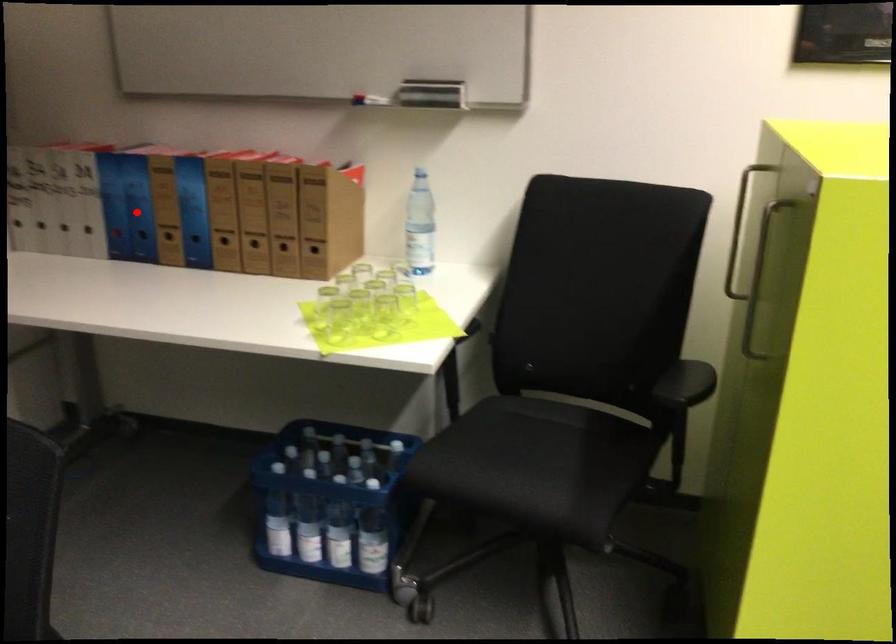
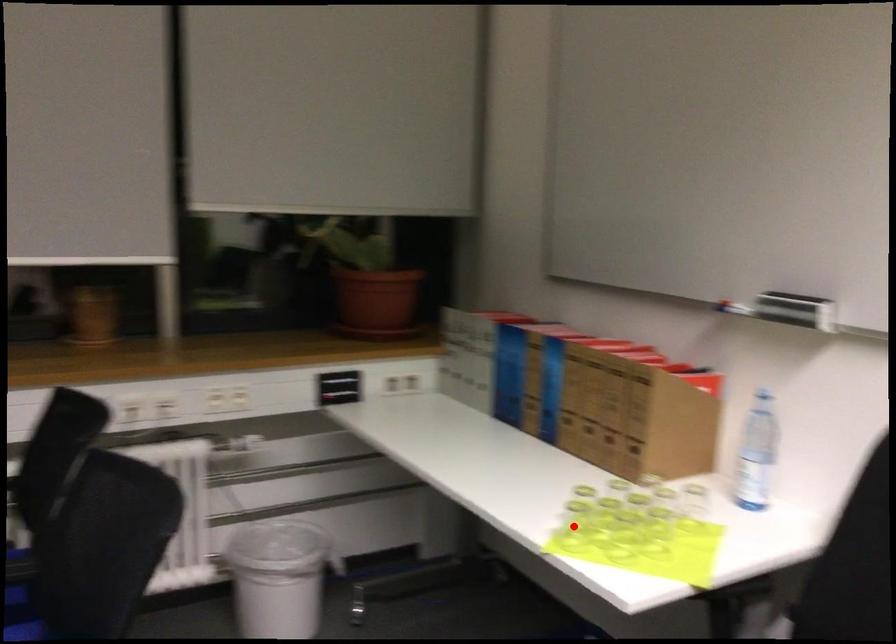
I am providing you with two images of the same scene from different viewpoints. A red point is marked on the first image and another point is marked on the second image. Is the red point in image1 aligned with the point shown in image2?

No